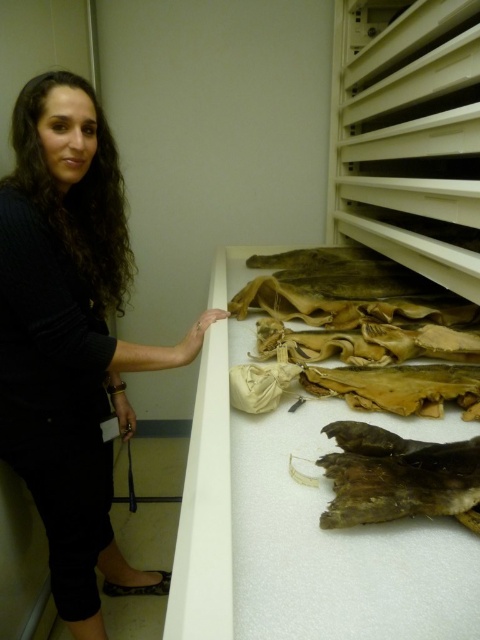
Question: Estimate the real-world distances between objects in this image. Which object is closer to the black sweater at left?

Choices:
 (A) brown leather bag at upper right
 (B) brown leather animal at lower right

Answer: (A)

Question: Observing the image, what is the correct spatial positioning of black sweater at left in reference to brown leather animal at lower right?

Choices:
 (A) right
 (B) left

Answer: (B)

Question: Based on their relative distances, which object is farther from the brown leather animal at lower right?

Choices:
 (A) black sweater at left
 (B) brown leather bag at upper right

Answer: (A)

Question: Based on their relative distances, which object is farther from the black sweater at left?

Choices:
 (A) brown leather bag at upper right
 (B) brown leather animal at lower right

Answer: (B)

Question: Can you confirm if brown leather bag at upper right is smaller than brown leather animal at lower right?

Choices:
 (A) no
 (B) yes

Answer: (A)

Question: From the image, what is the correct spatial relationship of brown leather bag at upper right in relation to brown leather animal at lower right?

Choices:
 (A) above
 (B) below

Answer: (A)